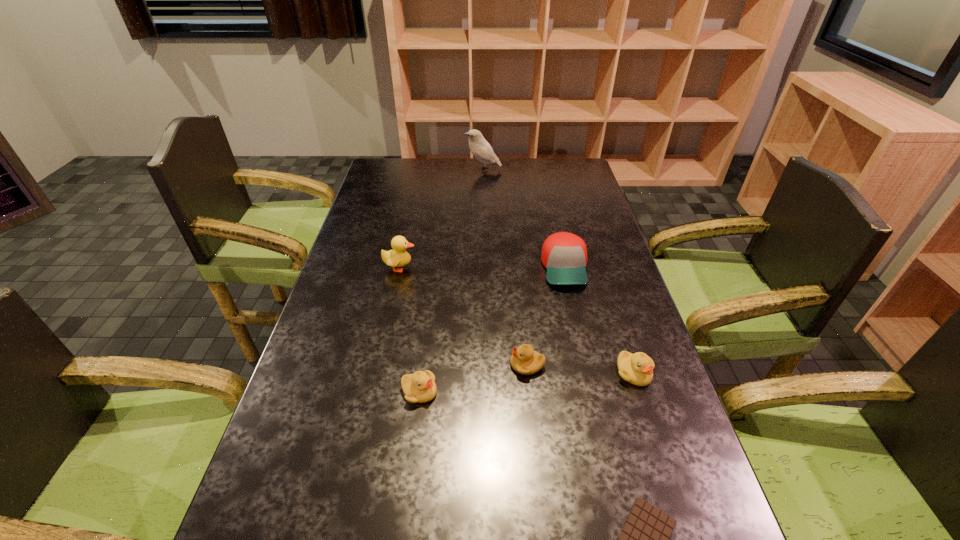
The image size is (960, 540). I want to click on the farthest object, so click(x=480, y=148).

The width and height of the screenshot is (960, 540). I want to click on the tallest object, so click(480, 148).

The width and height of the screenshot is (960, 540). What are the coordinates of `the leftmost object` in the screenshot? It's located at (398, 257).

Where is `the tallest duckling`? Image resolution: width=960 pixels, height=540 pixels. the tallest duckling is located at coordinates (398, 257).

Find the location of a particular element. Image resolution: width=960 pixels, height=540 pixels. the third tallest object is located at coordinates [x=564, y=255].

The width and height of the screenshot is (960, 540). Identify the location of the rightmost duckling. (637, 368).

At what (x,y) coordinates should I click in order to perform the action: click on the second object from left to right. Please return your answer as a coordinate pair (x, y). The image size is (960, 540). Looking at the image, I should click on (419, 387).

You are a GUI agent. You are given a task and a screenshot of the screen. Output one action in this format:
    pyautogui.click(x=<x>, y=<y>)
    Task: Click on the second duckling from right to left
    The height and width of the screenshot is (540, 960).
    Given the screenshot: What is the action you would take?
    pyautogui.click(x=524, y=360)

This screenshot has height=540, width=960. I want to click on free space located at the beak of the bird, so click(388, 170).

This screenshot has width=960, height=540. In order to click on blank space located at the beak of the bird in this screenshot , I will do `click(420, 170)`.